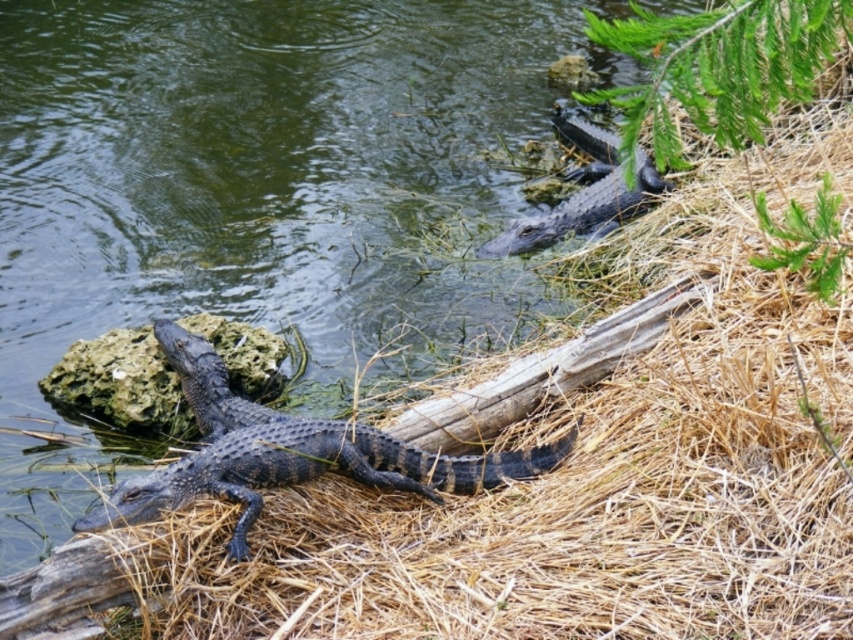
Question: Does shiny black crocodile at center appear on the right side of gray rock at center?

Choices:
 (A) no
 (B) yes

Answer: (B)

Question: Is shiny black crocodile at center smaller than gray rock at center?

Choices:
 (A) yes
 (B) no

Answer: (B)

Question: Which point is farther to the camera?

Choices:
 (A) shiny black crocodile at upper right
 (B) shiny black crocodile at center

Answer: (A)

Question: Considering the real-world distances, which object is farthest from the shiny black crocodile at upper right?

Choices:
 (A) gray rock at center
 (B) shiny black crocodile at center

Answer: (B)

Question: Does shiny black crocodile at center appear on the right side of shiny black crocodile at upper right?

Choices:
 (A) yes
 (B) no

Answer: (B)

Question: Which point is closer to the camera?

Choices:
 (A) shiny black crocodile at center
 (B) shiny black crocodile at upper right

Answer: (A)